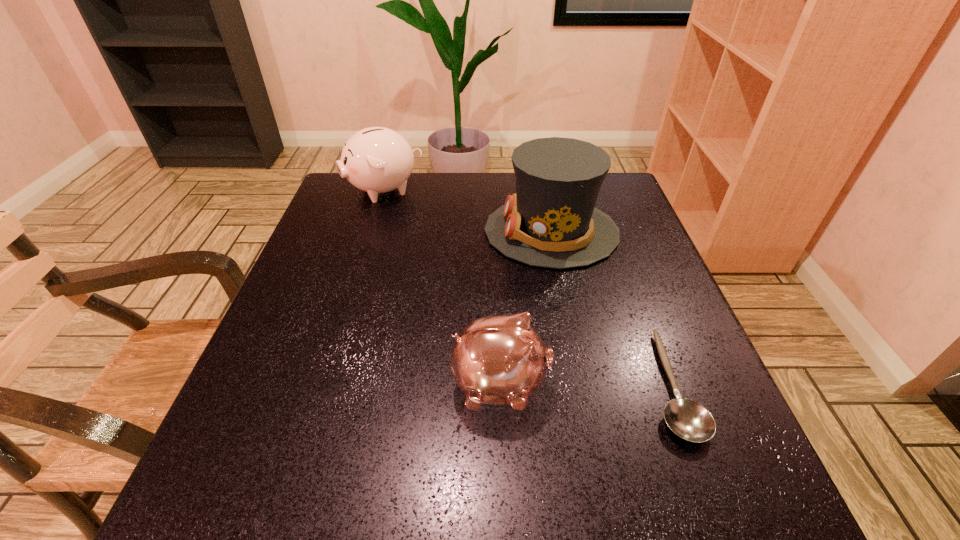
In the image, there is a desktop. Where is `vacant area at the near edge`? vacant area at the near edge is located at coordinates (354, 481).

The height and width of the screenshot is (540, 960). In order to click on vacant space at the left edge of the desktop in this screenshot , I will do `click(327, 321)`.

The image size is (960, 540). Identify the location of blank space at the right edge of the desktop. (661, 338).

This screenshot has width=960, height=540. In order to click on blank area at the far left corner in this screenshot , I will do `click(366, 197)`.

What are the coordinates of `blank space at the near left corner of the desktop` in the screenshot? It's located at (280, 504).

The width and height of the screenshot is (960, 540). Find the location of `free space between the left piggy bank and the dress hat`. free space between the left piggy bank and the dress hat is located at coordinates (468, 211).

The width and height of the screenshot is (960, 540). In order to click on vacant space in between the taller piggy bank and the ladle in this screenshot , I will do `click(527, 288)`.

This screenshot has height=540, width=960. In order to click on vacant area that lies between the farther piggy bank and the third tallest object in this screenshot , I will do `click(442, 287)`.

This screenshot has height=540, width=960. What are the coordinates of `free space between the taller piggy bank and the nearer piggy bank` in the screenshot? It's located at (442, 287).

At what (x,y) coordinates should I click in order to perform the action: click on empty space between the ladle and the nearer piggy bank. Please return your answer as a coordinate pair (x, y). The height and width of the screenshot is (540, 960). Looking at the image, I should click on (585, 385).